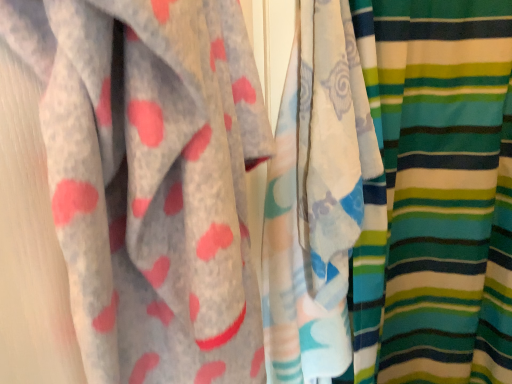
You are a GUI agent. You are given a task and a screenshot of the screen. Output one action in this format:
    pyautogui.click(x=<x>, y=<y>)
    Task: Click on the white cotton towel at center, acting as the second curtain starting from the right
    The height and width of the screenshot is (384, 512).
    Given the screenshot: What is the action you would take?
    pyautogui.click(x=316, y=198)

Describe the element at coordinates (316, 198) in the screenshot. The height and width of the screenshot is (384, 512). I see `white cotton towel at center, positioned as the first curtain in left-to-right order` at that location.

The height and width of the screenshot is (384, 512). Find the location of `striped fabric at right, which ranks as the 1th curtain in right-to-left order`. striped fabric at right, which ranks as the 1th curtain in right-to-left order is located at coordinates (436, 193).

Measure the distance between point (369, 244) and camera.

Point (369, 244) and camera are 35.28 inches apart from each other.

The image size is (512, 384). What do you see at coordinates (436, 193) in the screenshot?
I see `striped fabric at right, which ranks as the 1th curtain in right-to-left order` at bounding box center [436, 193].

What is the approximate height of striped fabric at right, which ranks as the 1th curtain in right-to-left order?

1.38 meters.

The image size is (512, 384). What are the coordinates of `white cotton towel at center, acting as the second curtain starting from the right` in the screenshot? It's located at (316, 198).

Between striped fabric at right, marked as the second curtain in a left-to-right arrangement, and white cotton towel at center, acting as the second curtain starting from the right, which one appears on the left side from the viewer's perspective?

white cotton towel at center, acting as the second curtain starting from the right.

Considering their positions, is striped fabric at right, which ranks as the 1th curtain in right-to-left order, located in front of or behind white cotton towel at center, positioned as the first curtain in left-to-right order?

Clearly, striped fabric at right, which ranks as the 1th curtain in right-to-left order, is behind white cotton towel at center, positioned as the first curtain in left-to-right order.

Is point (499, 209) closer or farther from the camera than point (361, 213)?

Point (499, 209) appears to be farther away from the viewer than point (361, 213).

Consider the image. From the image's perspective, is striped fabric at right, which ranks as the 1th curtain in right-to-left order, positioned above or below white cotton towel at center, positioned as the first curtain in left-to-right order?

From the image's perspective, striped fabric at right, which ranks as the 1th curtain in right-to-left order, appears below white cotton towel at center, positioned as the first curtain in left-to-right order.

Looking at this image, from a real-world perspective, is striped fabric at right, marked as the second curtain in a left-to-right arrangement, under white cotton towel at center, acting as the second curtain starting from the right?

Correct, in the physical world, striped fabric at right, marked as the second curtain in a left-to-right arrangement, is lower than white cotton towel at center, acting as the second curtain starting from the right.

Which of these two, striped fabric at right, which ranks as the 1th curtain in right-to-left order, or white cotton towel at center, acting as the second curtain starting from the right, is thinner?

With smaller width is white cotton towel at center, acting as the second curtain starting from the right.

Who is taller, striped fabric at right, which ranks as the 1th curtain in right-to-left order, or white cotton towel at center, acting as the second curtain starting from the right?

striped fabric at right, which ranks as the 1th curtain in right-to-left order, is taller.

In terms of size, does striped fabric at right, which ranks as the 1th curtain in right-to-left order, appear bigger or smaller than white cotton towel at center, positioned as the first curtain in left-to-right order?

striped fabric at right, which ranks as the 1th curtain in right-to-left order, is bigger than white cotton towel at center, positioned as the first curtain in left-to-right order.

Which is correct: striped fabric at right, marked as the second curtain in a left-to-right arrangement, is inside white cotton towel at center, positioned as the first curtain in left-to-right order, or outside of it?

striped fabric at right, marked as the second curtain in a left-to-right arrangement, is not inside white cotton towel at center, positioned as the first curtain in left-to-right order, it's outside.

Is striped fabric at right, marked as the second curtain in a left-to-right arrangement, positioned far away from white cotton towel at center, acting as the second curtain starting from the right?

striped fabric at right, marked as the second curtain in a left-to-right arrangement, is near white cotton towel at center, acting as the second curtain starting from the right, not far away.

Is striped fabric at right, which ranks as the 1th curtain in right-to-left order, turned away from white cotton towel at center, acting as the second curtain starting from the right?

No, striped fabric at right, which ranks as the 1th curtain in right-to-left order,'s orientation is not away from white cotton towel at center, acting as the second curtain starting from the right.

How many degrees apart are the facing directions of striped fabric at right, marked as the second curtain in a left-to-right arrangement, and white cotton towel at center, acting as the second curtain starting from the right?

The angular difference between striped fabric at right, marked as the second curtain in a left-to-right arrangement, and white cotton towel at center, acting as the second curtain starting from the right, is 0.000266 degrees.

Where is `curtain above the striped fabric at right, marked as the second curtain in a left-to-right arrangement (from the image's perspective)`? The width and height of the screenshot is (512, 384). curtain above the striped fabric at right, marked as the second curtain in a left-to-right arrangement (from the image's perspective) is located at coordinates (316, 198).

Is white cotton towel at center, acting as the second curtain starting from the right, to the left of striped fabric at right, marked as the second curtain in a left-to-right arrangement, from the viewer's perspective?

Yes, white cotton towel at center, acting as the second curtain starting from the right, is to the left of striped fabric at right, marked as the second curtain in a left-to-right arrangement.

Is the depth of white cotton towel at center, acting as the second curtain starting from the right, less than that of striped fabric at right, which ranks as the 1th curtain in right-to-left order?

Yes, it is.

Which is closer to the camera, [281,315] or [442,143]?

The point [281,315] is more forward.

From the image's perspective, would you say white cotton towel at center, acting as the second curtain starting from the right, is positioned over striped fabric at right, marked as the second curtain in a left-to-right arrangement?

Yes, from the image's perspective, white cotton towel at center, acting as the second curtain starting from the right, is above striped fabric at right, marked as the second curtain in a left-to-right arrangement.

Looking at this image, from a real-world perspective, which object rests below the other?

striped fabric at right, marked as the second curtain in a left-to-right arrangement, is physically lower.

Consider the image. Between white cotton towel at center, positioned as the first curtain in left-to-right order, and striped fabric at right, which ranks as the 1th curtain in right-to-left order, which one has larger width?

With larger width is striped fabric at right, which ranks as the 1th curtain in right-to-left order.

Is white cotton towel at center, positioned as the first curtain in left-to-right order, taller or shorter than striped fabric at right, which ranks as the 1th curtain in right-to-left order?

Clearly, white cotton towel at center, positioned as the first curtain in left-to-right order, is shorter compared to striped fabric at right, which ranks as the 1th curtain in right-to-left order.

Who is bigger, white cotton towel at center, positioned as the first curtain in left-to-right order, or striped fabric at right, marked as the second curtain in a left-to-right arrangement?

Bigger between the two is striped fabric at right, marked as the second curtain in a left-to-right arrangement.

Could striped fabric at right, marked as the second curtain in a left-to-right arrangement, be considered to be inside white cotton towel at center, acting as the second curtain starting from the right?

No.

Would you consider white cotton towel at center, acting as the second curtain starting from the right, to be distant from striped fabric at right, marked as the second curtain in a left-to-right arrangement?

white cotton towel at center, acting as the second curtain starting from the right, is near striped fabric at right, marked as the second curtain in a left-to-right arrangement, not far away.

Looking at this image, could you tell me if white cotton towel at center, acting as the second curtain starting from the right, is facing striped fabric at right, marked as the second curtain in a left-to-right arrangement?

Yes, white cotton towel at center, acting as the second curtain starting from the right, is aimed at striped fabric at right, marked as the second curtain in a left-to-right arrangement.

You are a GUI agent. You are given a task and a screenshot of the screen. Output one action in this format:
    pyautogui.click(x=<x>, y=<y>)
    Task: Click on the curtain to the right of white cotton towel at center, acting as the second curtain starting from the right
    The image size is (512, 384).
    Given the screenshot: What is the action you would take?
    pyautogui.click(x=436, y=193)

The width and height of the screenshot is (512, 384). Find the location of `curtain below the white cotton towel at center, positioned as the first curtain in left-to-right order (from the image's perspective)`. curtain below the white cotton towel at center, positioned as the first curtain in left-to-right order (from the image's perspective) is located at coordinates (436, 193).

Where is `curtain that appears on the left of striped fabric at right, which ranks as the 1th curtain in right-to-left order`? The height and width of the screenshot is (384, 512). curtain that appears on the left of striped fabric at right, which ranks as the 1th curtain in right-to-left order is located at coordinates [316, 198].